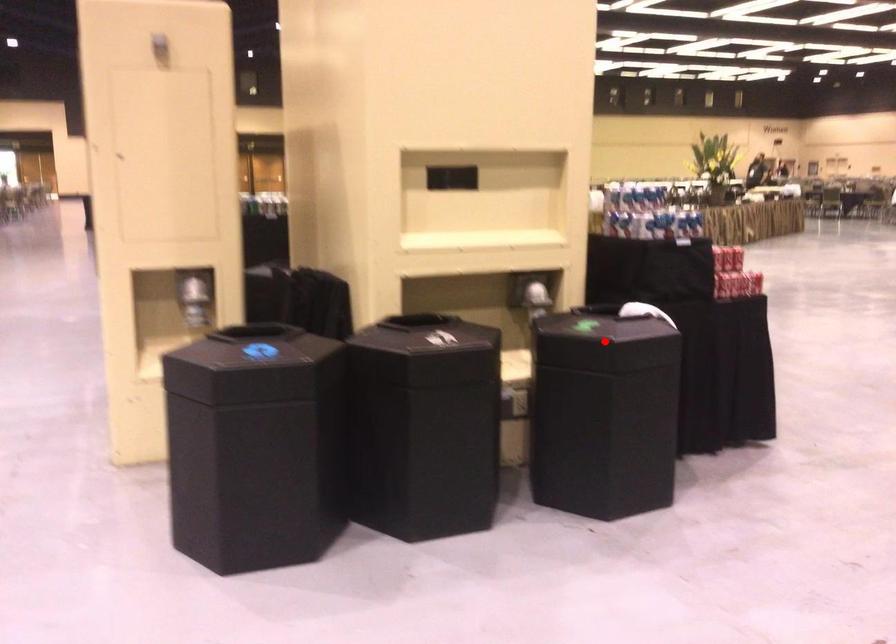
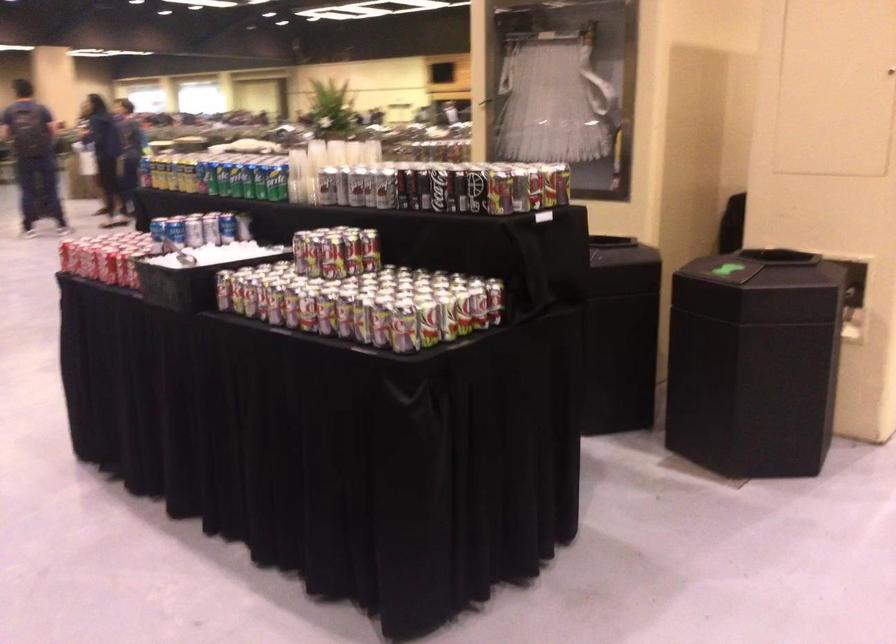
Question: I am providing you with two images of the same scene from different viewpoints. A red point is marked on the first image. At the location where the point appears in image 1, is it still visible in image 2?

Choices:
 (A) Yes
 (B) No

Answer: (B)